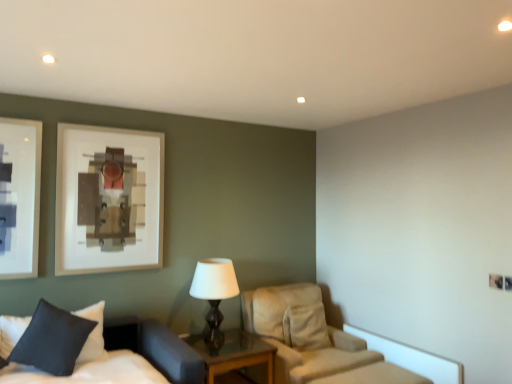
Question: From a real-world perspective, is dark blue fabric pillow at lower left positioned above or below white soft bed at lower left?

Choices:
 (A) above
 (B) below

Answer: (A)

Question: In terms of width, does dark blue fabric pillow at lower left look wider or thinner when compared to white soft bed at lower left?

Choices:
 (A) wide
 (B) thin

Answer: (B)

Question: Estimate the real-world distances between objects in this image. Which object is farther from the dark blue fabric pillow at lower left?

Choices:
 (A) beige fabric chair at center
 (B) white soft bed at lower left
 (C) wooden glass top nightstand at center
 (D) matte black table lamp at center

Answer: (A)

Question: Which object is the farthest from the matte black table lamp at center?

Choices:
 (A) white soft bed at lower left
 (B) wooden glass top nightstand at center
 (C) dark blue fabric pillow at lower left
 (D) beige fabric chair at center

Answer: (C)